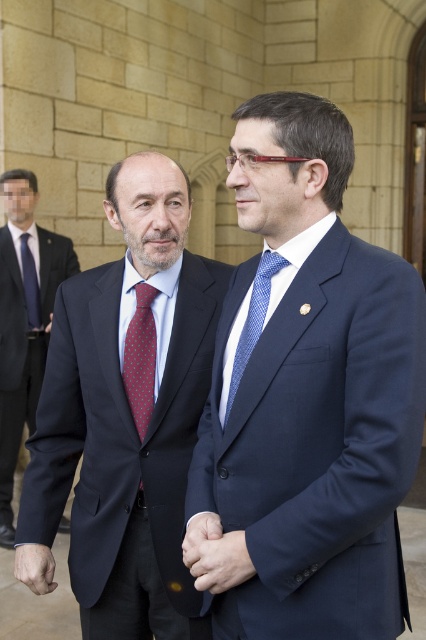
Question: Is matte black suit at center thinner than red dotted tie at left?

Choices:
 (A) no
 (B) yes

Answer: (A)

Question: Which of the following is the closest to the observer?

Choices:
 (A) blue textured suit at center
 (B) red dotted tie at center
 (C) blue dotted tie at center

Answer: (A)

Question: Which object is closer to the camera taking this photo?

Choices:
 (A) matte black hand at center
 (B) smooth skin hand at center

Answer: (A)

Question: Is matte black suit at center positioned at the back of blue dotted tie at center?

Choices:
 (A) yes
 (B) no

Answer: (A)

Question: Which object is the farthest from the red dotted tie at left?

Choices:
 (A) blue textured suit at center
 (B) matte black suit at center

Answer: (A)

Question: Is matte black hand at center in front of dark skin hand at center?

Choices:
 (A) no
 (B) yes

Answer: (B)